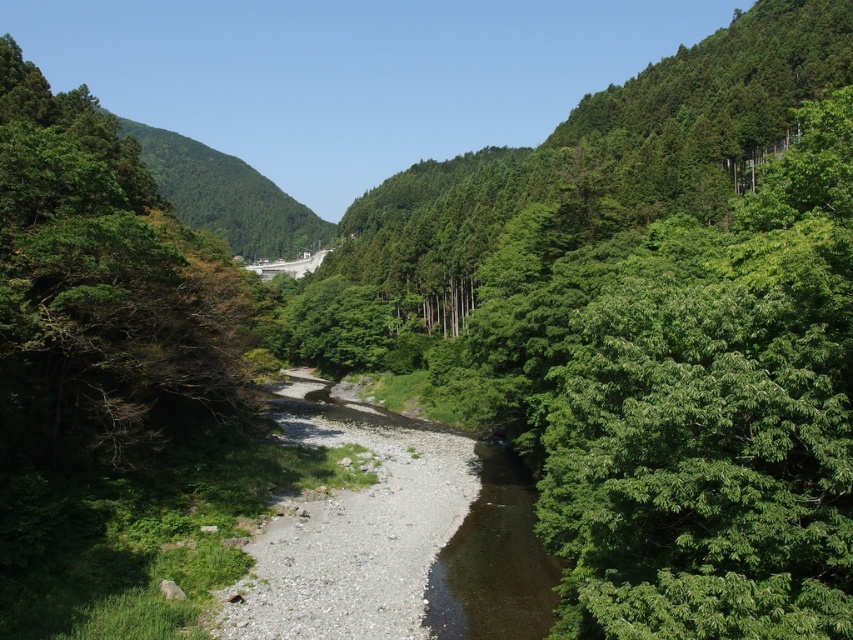
Based on the scene description, what can be found at the coordinates point [102,289]?

At point [102,289] lies green leafy tree at left.

You are standing at the origin point of the image. Which direction should you move to reach the green leafy tree at center?

The green leafy tree at center is located at coordinates approximately 0.514 on the x axis and 0.769 on the y axis. Since you are at the origin point, you should move towards the right and upwards to reach the green leafy tree at center.